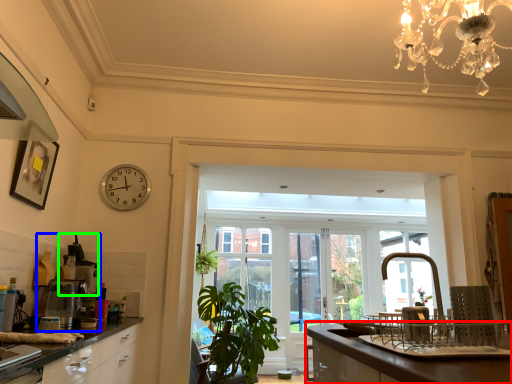
Question: Estimate the real-world distances between objects in this image. Which object is farther from countertop (highlighted by a red box), coffee machine (highlighted by a blue box) or appliance (highlighted by a green box)?

Choices:
 (A) coffee machine
 (B) appliance

Answer: (B)